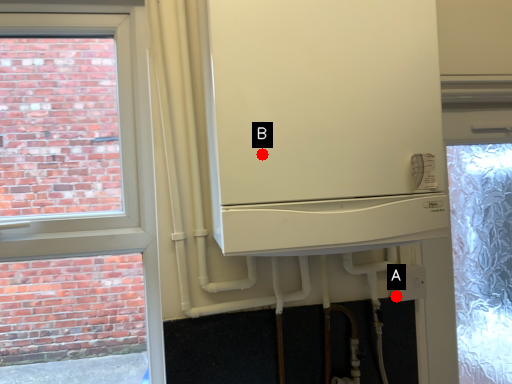
Question: Two points are circled on the image, labeled by A and B beside each circle. Which point is closer to the camera taking this photo?

Choices:
 (A) A is closer
 (B) B is closer

Answer: (B)